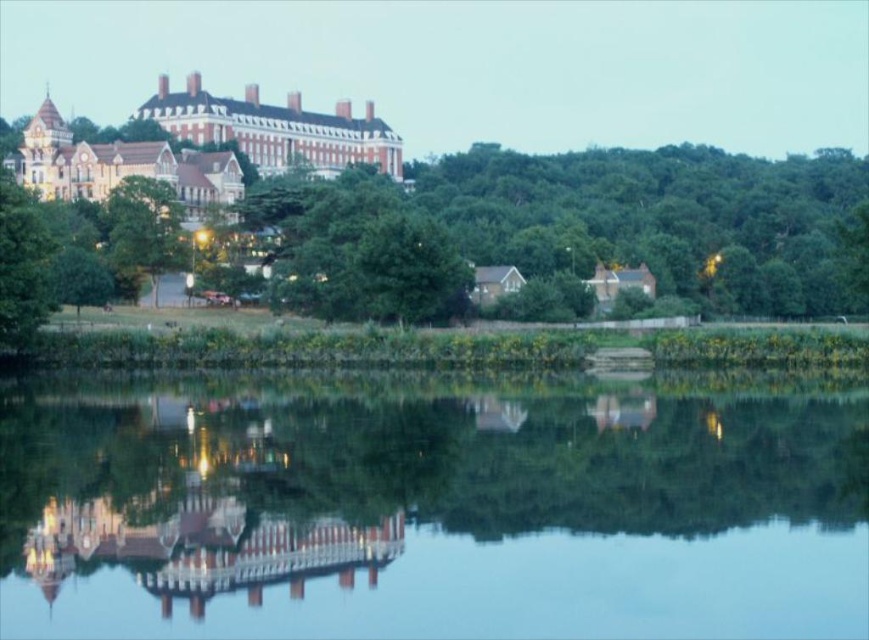
Does light brown stone building at upper center have a lesser width compared to white stone palace at upper left?

In fact, light brown stone building at upper center might be wider than white stone palace at upper left.

You are a GUI agent. You are given a task and a screenshot of the screen. Output one action in this format:
    pyautogui.click(x=<x>, y=<y>)
    Task: Click on the light brown stone building at upper center
    The image size is (869, 640).
    Given the screenshot: What is the action you would take?
    pyautogui.click(x=276, y=129)

Between transparent glass water at center and green leafy tree at center, which one appears on the left side from the viewer's perspective?

Positioned to the left is green leafy tree at center.

Is point (604, 480) positioned after point (178, 243)?

No, it is in front of (178, 243).

This screenshot has height=640, width=869. In order to click on transparent glass water at center in this screenshot , I will do `click(432, 508)`.

Is light brown stone building at upper center wider than green leafy tree at center?

Indeed, light brown stone building at upper center has a greater width compared to green leafy tree at center.

Is the position of light brown stone building at upper center less distant than that of green leafy tree at center?

No, it is behind green leafy tree at center.

Which is in front, point (224, 106) or point (157, 220)?

Point (157, 220)

Locate an element on the screen. This screenshot has height=640, width=869. light brown stone building at upper center is located at coordinates (276, 129).